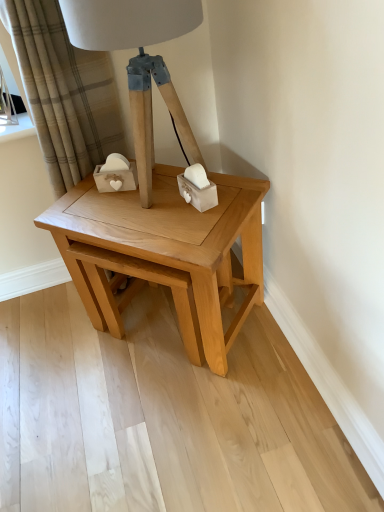
Question: Is beige plaid curtain at upper left thinner than natural wood table at center?

Choices:
 (A) no
 (B) yes

Answer: (B)

Question: Is natural wood table at center surrounded by beige plaid curtain at upper left?

Choices:
 (A) no
 (B) yes

Answer: (A)

Question: From a real-world perspective, is beige plaid curtain at upper left below natural wood table at center?

Choices:
 (A) no
 (B) yes

Answer: (A)

Question: Is beige plaid curtain at upper left wider than natural wood table at center?

Choices:
 (A) no
 (B) yes

Answer: (A)

Question: Is beige plaid curtain at upper left at the left side of natural wood table at center?

Choices:
 (A) no
 (B) yes

Answer: (B)

Question: From a real-world perspective, is natural wood table at center above or below beige plaid curtain at upper left?

Choices:
 (A) above
 (B) below

Answer: (B)

Question: Do you think natural wood table at center is within beige plaid curtain at upper left, or outside of it?

Choices:
 (A) inside
 (B) outside

Answer: (B)

Question: Is natural wood table at center bigger or smaller than beige plaid curtain at upper left?

Choices:
 (A) small
 (B) big

Answer: (B)

Question: Considering the relative positions of natural wood table at center and beige plaid curtain at upper left in the image provided, is natural wood table at center to the left or to the right of beige plaid curtain at upper left?

Choices:
 (A) left
 (B) right

Answer: (B)

Question: Does point (135, 0) appear closer or farther from the camera than point (109, 91)?

Choices:
 (A) closer
 (B) farther

Answer: (A)

Question: Considering the positions of matte wood table lamp at center and beige plaid curtain at upper left in the image, is matte wood table lamp at center wider or thinner than beige plaid curtain at upper left?

Choices:
 (A) wide
 (B) thin

Answer: (A)

Question: Is matte wood table lamp at center to the left or to the right of beige plaid curtain at upper left in the image?

Choices:
 (A) right
 (B) left

Answer: (A)

Question: From the image's perspective, relative to beige plaid curtain at upper left, is matte wood table lamp at center above or below?

Choices:
 (A) above
 (B) below

Answer: (A)

Question: Choose the correct answer: Is beige plaid curtain at upper left inside matte wood table lamp at center or outside it?

Choices:
 (A) outside
 (B) inside

Answer: (A)

Question: In terms of size, does beige plaid curtain at upper left appear bigger or smaller than matte wood table lamp at center?

Choices:
 (A) big
 (B) small

Answer: (A)